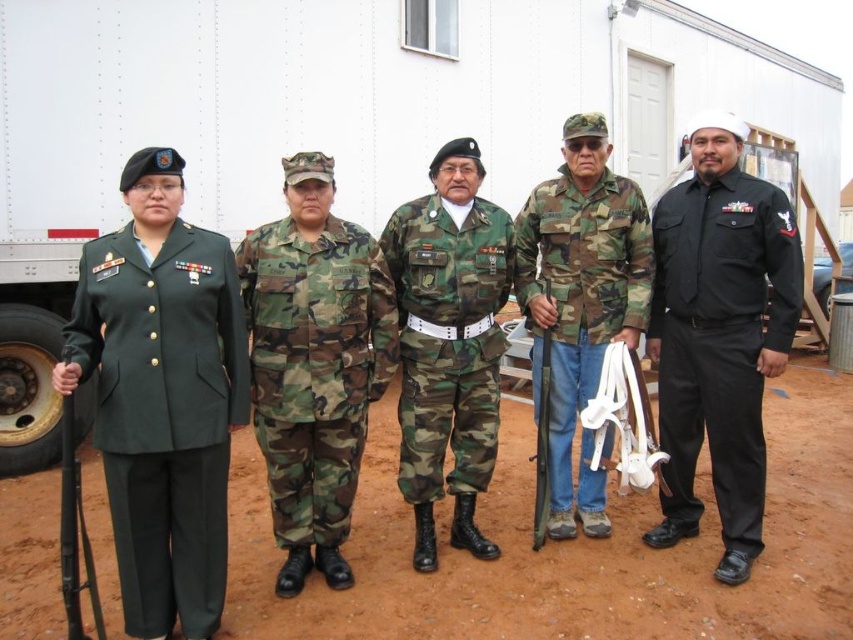
You are a photographer trying to capture a group photo of the black smooth uniform at right and the camo fabric uniform at center. Since you want both subjects to appear equally tall in the photo, which one should you position closer to the camera?

To make both the black smooth uniform at right and the camo fabric uniform at center appear equally tall in the photo, you should position the camo fabric uniform at center closer to the camera since it is shorter than the black smooth uniform at right.

Looking at this image, you are a photographer positioned in front of the trailer structure. You need to capture a photo where both the green matte uniform at left and the black smooth uniform at right are clearly visible. Considering their positions, which uniform will appear larger in the photo?

The green matte uniform at left will appear larger in the photo because it is closer to the viewer than the black smooth uniform at right.